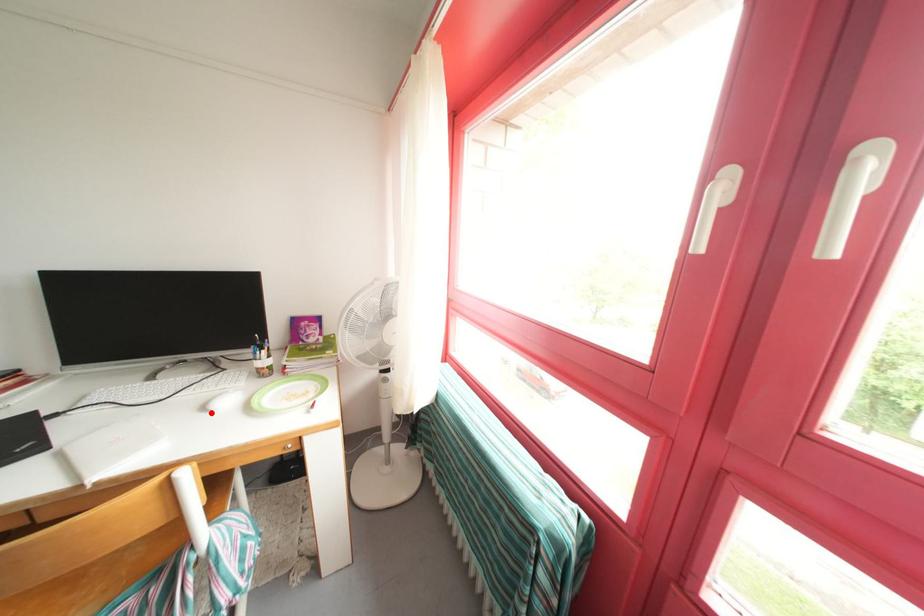
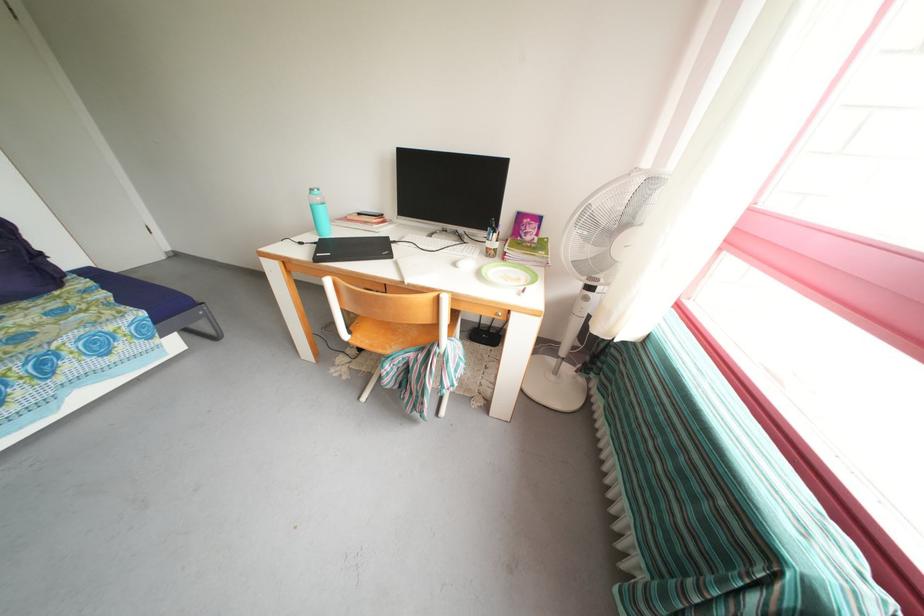
In the second image, find the point that corresponds to the highlighted location in the first image.

(462, 269)